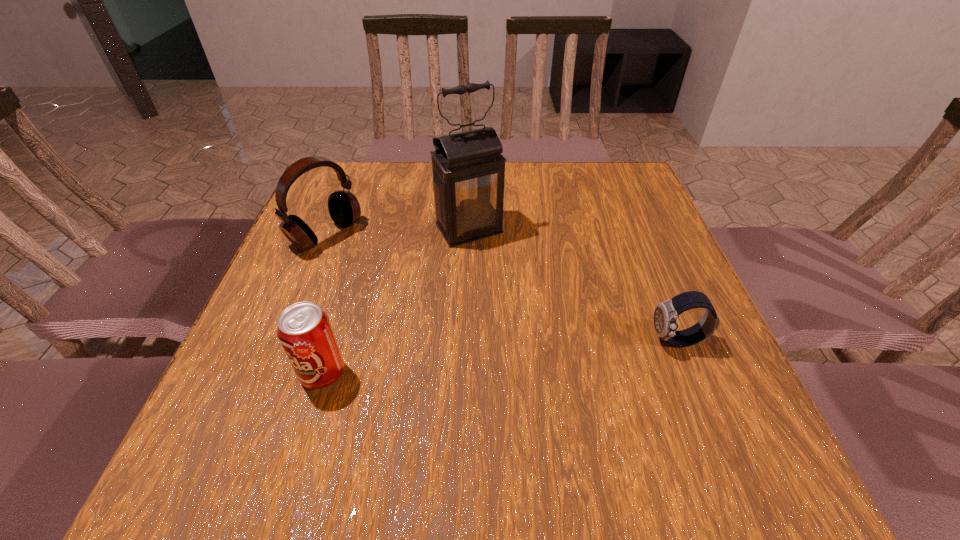
Where is `empty space that is in between the watch and the headset`? The height and width of the screenshot is (540, 960). empty space that is in between the watch and the headset is located at coordinates (501, 288).

You are a GUI agent. You are given a task and a screenshot of the screen. Output one action in this format:
    pyautogui.click(x=<x>, y=<y>)
    Task: Click on the vacant space in between the headset and the lantern
    The image size is (960, 540).
    Given the screenshot: What is the action you would take?
    pyautogui.click(x=397, y=232)

At what (x,y) coordinates should I click in order to perform the action: click on unoccupied position between the third shortest object and the rightmost object. Please return your answer as a coordinate pair (x, y). Looking at the image, I should click on (501, 288).

The height and width of the screenshot is (540, 960). I want to click on vacant space that is in between the lantern and the third tallest object, so click(x=396, y=301).

In order to click on empty space between the third tallest object and the headset in this screenshot , I will do `click(324, 305)`.

Select which object is the third closest to the headset. Please provide its 2D coordinates. Your answer should be formatted as a tuple, i.e. [(x, y)], where the tuple contains the x and y coordinates of a point satisfying the conditions above.

[(666, 313)]

This screenshot has height=540, width=960. What are the coordinates of `object that ranks as the second closest to the shortest object` in the screenshot? It's located at (304, 330).

Where is `blank area in the image that satisfies the following two spatial constraints: 1. on the front side of the headset; 2. on the left side of the soda`? The width and height of the screenshot is (960, 540). blank area in the image that satisfies the following two spatial constraints: 1. on the front side of the headset; 2. on the left side of the soda is located at coordinates (272, 374).

Where is `free spot that satisfies the following two spatial constraints: 1. on the front side of the headset; 2. on the face of the rightmost object`? The height and width of the screenshot is (540, 960). free spot that satisfies the following two spatial constraints: 1. on the front side of the headset; 2. on the face of the rightmost object is located at coordinates (284, 341).

Where is `vacant position in the image that satisfies the following two spatial constraints: 1. on the front side of the shortest object; 2. on the face of the tallest object`? Image resolution: width=960 pixels, height=540 pixels. vacant position in the image that satisfies the following two spatial constraints: 1. on the front side of the shortest object; 2. on the face of the tallest object is located at coordinates (466, 341).